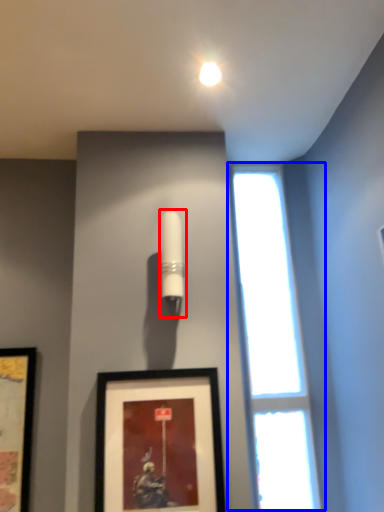
Question: Which object appears closest to the camera in this image, lamp (highlighted by a red box) or window (highlighted by a blue box)?

Choices:
 (A) lamp
 (B) window

Answer: (A)